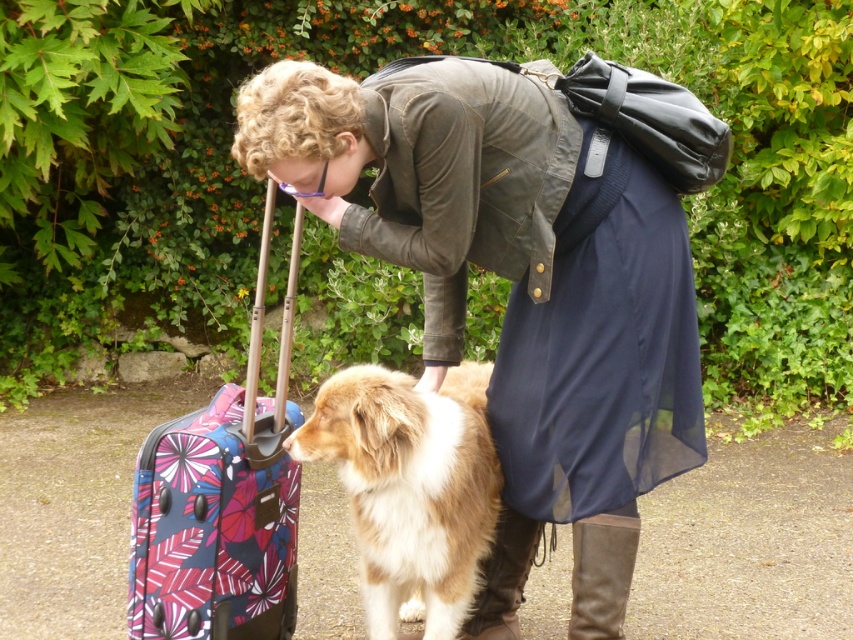
Question: Does matte olive green jacket at center appear over brown leather boot at lower center?

Choices:
 (A) yes
 (B) no

Answer: (A)

Question: Does patterned fabric suitcase at left appear on the left side of brown suede boot at lower center?

Choices:
 (A) yes
 (B) no

Answer: (A)

Question: Which object appears closest to the camera in this image?

Choices:
 (A) brown suede boot at lower center
 (B) matte olive green jacket at center
 (C) brown leather boot at lower center

Answer: (B)

Question: Does patterned fabric suitcase at left appear under brown suede boot at lower center?

Choices:
 (A) no
 (B) yes

Answer: (A)

Question: Considering the real-world distances, which object is farthest from the patterned fabric suitcase at left?

Choices:
 (A) brown fluffy dog at center
 (B) matte olive green jacket at center

Answer: (B)

Question: Among these points, which one is farthest from the camera?

Choices:
 (A) (148, 534)
 (B) (495, 557)
 (C) (416, 536)

Answer: (B)